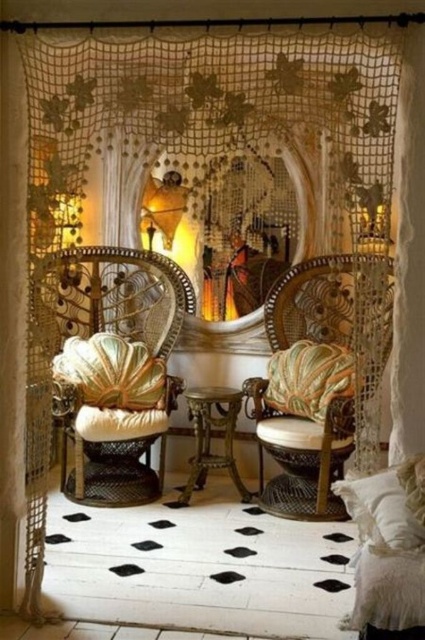
You are sitting in the reading nook and want to place a book on the table between the matte wicker armchair at center and the white fluffy pillow at lower right. Which object is closer to the table?

The matte wicker armchair at center is positioned on the left side of white fluffy pillow at lower right, so the matte wicker armchair at center is closer to the table than the white fluffy pillow at lower right.

You are trying to determine if the white fluffy pillow at lower right can be placed on top of the matte wicker armchair at center without falling off. Based on their heights, is this possible?

The matte wicker armchair at center is taller than the white fluffy pillow at lower right, so the pillow can be placed on top of the armchair without falling off since it is shorter and more stable.

You are planning to host a small gathering in this cozy reading nook and need to determine if the velvet gold armchair at left and the matte wicker armchair at center can fit side by side along the wall without overlapping. Based on their widths, can they be placed next to each other?

The velvet gold armchair at left might be wider than matte wicker armchair at center, so there is a possibility they might not fit side by side without overlapping if the combined width exceeds the available space.